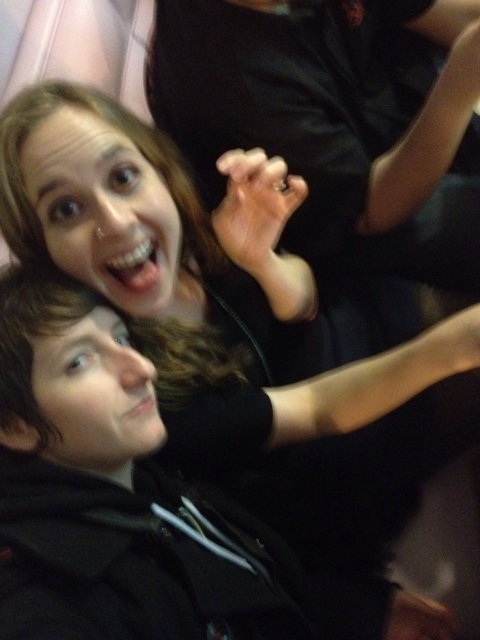
Is point (264, 112) less distant than point (85, 605)?

That is False.

Based on the photo, between matte black hand at center and black hoodie at lower left, which one is positioned higher?

matte black hand at center is above.

Is point (400, 156) positioned behind point (12, 387)?

Yes, point (400, 156) is behind point (12, 387).

The image size is (480, 640). Identify the location of matte black hand at center. (333, 122).